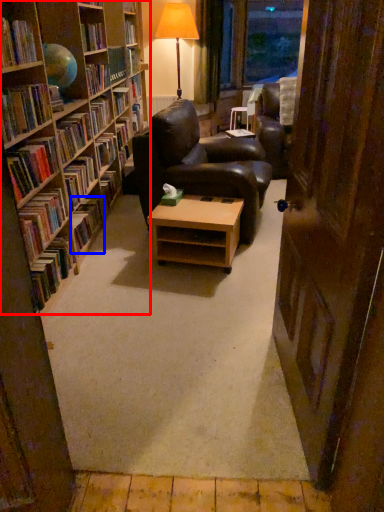
Question: Among these objects, which one is nearest to the camera, bookcase (highlighted by a red box) or book (highlighted by a blue box)?

Choices:
 (A) bookcase
 (B) book

Answer: (A)